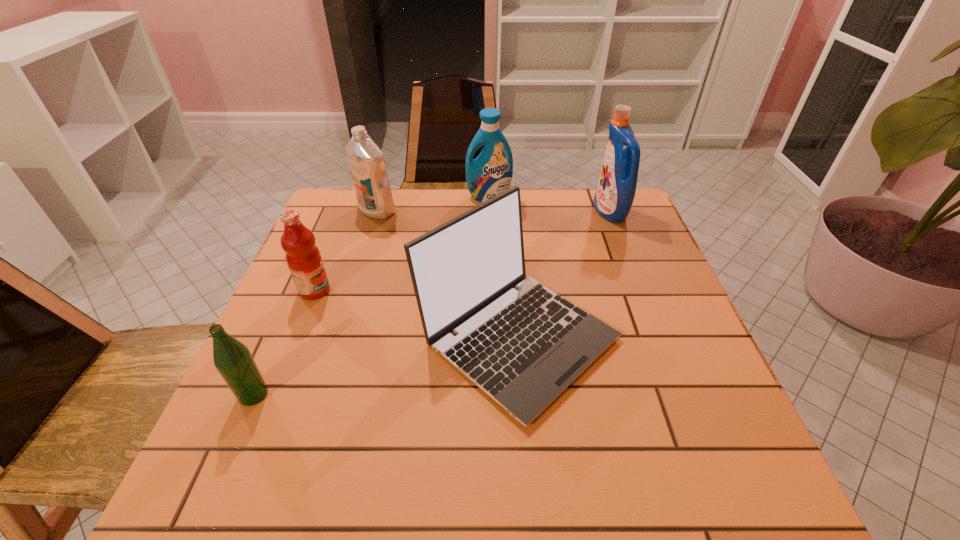
In order to click on vacant point located between the second detergent from right to left and the shortest object in this screenshot , I will do `click(372, 295)`.

At what (x,y) coordinates should I click in order to perform the action: click on vacant area that lies between the second detergent from left to right and the fruit juice. Please return your answer as a coordinate pair (x, y). Looking at the image, I should click on (401, 244).

You are a GUI agent. You are given a task and a screenshot of the screen. Output one action in this format:
    pyautogui.click(x=<x>, y=<y>)
    Task: Click on the free space that is in between the leftmost detergent and the second detergent from left to right
    The image size is (960, 540).
    Given the screenshot: What is the action you would take?
    433,204

You are a GUI agent. You are given a task and a screenshot of the screen. Output one action in this format:
    pyautogui.click(x=<x>, y=<y>)
    Task: Click on the object that stands as the third closest to the laptop_computer
    The width and height of the screenshot is (960, 540).
    Given the screenshot: What is the action you would take?
    pyautogui.click(x=365, y=159)

Image resolution: width=960 pixels, height=540 pixels. I want to click on object that can be found as the fifth closest to the rightmost object, so click(233, 360).

Locate an element on the screen. Image resolution: width=960 pixels, height=540 pixels. detergent that is the second nearest to the laptop_computer is located at coordinates (365, 159).

Where is `detergent that is the second nearest to the second detergent from left to right`? The height and width of the screenshot is (540, 960). detergent that is the second nearest to the second detergent from left to right is located at coordinates (615, 192).

I want to click on free spot that satisfies the following two spatial constraints: 1. on the label of the rightmost detergent; 2. at the front screen of the laptop_computer, so click(659, 336).

Where is `vacant area that satisfies the following two spatial constraints: 1. on the label of the rightmost object; 2. on the front side of the bottle`? vacant area that satisfies the following two spatial constraints: 1. on the label of the rightmost object; 2. on the front side of the bottle is located at coordinates point(681,395).